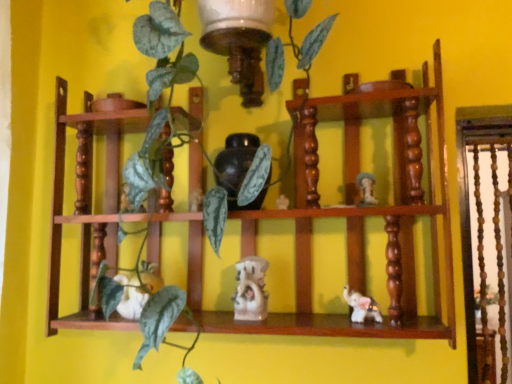
The width and height of the screenshot is (512, 384). I want to click on matte black vase at center, so click(x=237, y=168).

What do you see at coordinates (348, 227) in the screenshot?
I see `wooden shelf at center` at bounding box center [348, 227].

Locate an element on the screen. The width and height of the screenshot is (512, 384). white glossy elephant at lower right, positioned as the third toy in left-to-right order is located at coordinates (361, 306).

This screenshot has width=512, height=384. In order to click on white matte rabbit at center, the fourth toy from the right in this screenshot , I will do `click(138, 290)`.

This screenshot has width=512, height=384. I want to click on matte black vase at center, so click(x=237, y=168).

Is white glossy elephant at lower right, positioned as the second toy in right-to-left order, aimed at white glossy mushroom at upper right, positioned as the fourth toy in left-to-right order?

No, white glossy elephant at lower right, positioned as the second toy in right-to-left order, is not aimed at white glossy mushroom at upper right, positioned as the fourth toy in left-to-right order.

From a real-world perspective, is white glossy elephant at lower right, positioned as the second toy in right-to-left order, beneath white glossy mushroom at upper right, the first toy viewed from the right?

Correct, in the physical world, white glossy elephant at lower right, positioned as the second toy in right-to-left order, is lower than white glossy mushroom at upper right, the first toy viewed from the right.

There is a white glossy mushroom at upper right, the first toy viewed from the right. Where is `the 3rd toy below it (from the image's perspective)`? The width and height of the screenshot is (512, 384). the 3rd toy below it (from the image's perspective) is located at coordinates (361, 306).

Which of these two, wooden shelf at center or white glossy mushroom at upper right, the first toy viewed from the right, is thinner?

white glossy mushroom at upper right, the first toy viewed from the right, is thinner.

From a real-world perspective, is wooden shelf at center physically located above or below white glossy mushroom at upper right, the first toy viewed from the right?

In terms of real-world spatial position, wooden shelf at center is above white glossy mushroom at upper right, the first toy viewed from the right.

Between wooden shelf at center and white glossy mushroom at upper right, the first toy viewed from the right, which one appears on the right side from the viewer's perspective?

white glossy mushroom at upper right, the first toy viewed from the right, is more to the right.

Considering the relative sizes of white glossy mushroom at upper right, the first toy viewed from the right, and white matte rabbit at center, arranged as the first toy when viewed from the left, in the image provided, is white glossy mushroom at upper right, the first toy viewed from the right, wider than white matte rabbit at center, arranged as the first toy when viewed from the left,?

No.

From the picture: Would you say white glossy mushroom at upper right, the first toy viewed from the right, is outside white matte rabbit at center, the fourth toy from the right?

Indeed, white glossy mushroom at upper right, the first toy viewed from the right, is completely outside white matte rabbit at center, the fourth toy from the right.

Is white glossy mushroom at upper right, the first toy viewed from the right, far from white matte rabbit at center, the fourth toy from the right?

They are positioned close to each other.

Where is `the 3rd toy counting from the left side of the white glossy mushroom at upper right, positioned as the fourth toy in left-to-right order`? This screenshot has height=384, width=512. the 3rd toy counting from the left side of the white glossy mushroom at upper right, positioned as the fourth toy in left-to-right order is located at coordinates (138, 290).

Can you see white glossy mushroom at upper right, the first toy viewed from the right, touching matte black vase at center?

No, white glossy mushroom at upper right, the first toy viewed from the right, is not touching matte black vase at center.

Looking at this image, from a real-world perspective, relative to matte black vase at center, is white glossy mushroom at upper right, positioned as the fourth toy in left-to-right order, vertically above or below?

white glossy mushroom at upper right, positioned as the fourth toy in left-to-right order, is below matte black vase at center.

Considering the sizes of objects white glossy mushroom at upper right, the first toy viewed from the right, and matte black vase at center in the image provided, who is taller, white glossy mushroom at upper right, the first toy viewed from the right, or matte black vase at center?

matte black vase at center is taller.

Considering the relative sizes of white glossy mushroom at upper right, positioned as the fourth toy in left-to-right order, and matte black vase at center in the image provided, is white glossy mushroom at upper right, positioned as the fourth toy in left-to-right order, thinner than matte black vase at center?

Correct, the width of white glossy mushroom at upper right, positioned as the fourth toy in left-to-right order, is less than that of matte black vase at center.

Does point (234, 216) come in front of point (246, 307)?

No.

Can you confirm if wooden shelf at center is bigger than white glossy statue at center, arranged as the 3th toy when viewed from the right?

Yes.

Is wooden shelf at center taller or shorter than white glossy statue at center, arranged as the 3th toy when viewed from the right?

In the image, wooden shelf at center appears to be taller than white glossy statue at center, arranged as the 3th toy when viewed from the right.

Is wooden shelf at center directly adjacent to white glossy statue at center, arranged as the 3th toy when viewed from the right?

No, wooden shelf at center is not with white glossy statue at center, arranged as the 3th toy when viewed from the right.

From a real-world perspective, who is located higher, white glossy elephant at lower right, positioned as the second toy in right-to-left order, or white glossy statue at center, arranged as the 2th toy when viewed from the left?

white glossy statue at center, arranged as the 2th toy when viewed from the left.

Could you tell me if white glossy elephant at lower right, positioned as the second toy in right-to-left order, is turned towards white glossy statue at center, arranged as the 3th toy when viewed from the right?

No, white glossy elephant at lower right, positioned as the second toy in right-to-left order, is not aimed at white glossy statue at center, arranged as the 3th toy when viewed from the right.

Could white glossy statue at center, arranged as the 3th toy when viewed from the right, be considered to be inside white glossy elephant at lower right, positioned as the second toy in right-to-left order?

No.

Can you see white glossy elephant at lower right, positioned as the third toy in left-to-right order, touching white glossy statue at center, arranged as the 2th toy when viewed from the left?

No, white glossy elephant at lower right, positioned as the third toy in left-to-right order, is not with white glossy statue at center, arranged as the 2th toy when viewed from the left.

Is white glossy statue at center, arranged as the 3th toy when viewed from the right, not near white glossy mushroom at upper right, positioned as the fourth toy in left-to-right order?

That's not correct — white glossy statue at center, arranged as the 3th toy when viewed from the right, is a little close to white glossy mushroom at upper right, positioned as the fourth toy in left-to-right order.

Which of these two, white glossy statue at center, arranged as the 2th toy when viewed from the left, or white glossy mushroom at upper right, positioned as the fourth toy in left-to-right order, stands taller?

white glossy statue at center, arranged as the 2th toy when viewed from the left, is taller.

Is white glossy statue at center, arranged as the 3th toy when viewed from the right, at the right side of white glossy mushroom at upper right, positioned as the fourth toy in left-to-right order?

Incorrect, white glossy statue at center, arranged as the 3th toy when viewed from the right, is not on the right side of white glossy mushroom at upper right, positioned as the fourth toy in left-to-right order.

Does point (253, 272) appear closer or farther from the camera than point (362, 195)?

Clearly, point (253, 272) is closer to the camera than point (362, 195).

Identify the location of the 3rd toy positioned below the white glossy mushroom at upper right, the first toy viewed from the right (from a real-world perspective). (361, 306).

At what (x,y) coordinates should I click in order to perform the action: click on the 3rd toy counting from the right side of the wooden shelf at center. Please return your answer as a coordinate pair (x, y). This screenshot has width=512, height=384. Looking at the image, I should click on click(366, 189).

Considering their positions, is white glossy mushroom at upper right, the first toy viewed from the right, positioned closer to matte black vase at center than white glossy statue at center, arranged as the 3th toy when viewed from the right?

white glossy statue at center, arranged as the 3th toy when viewed from the right.

When comparing their distances from white matte rabbit at center, arranged as the first toy when viewed from the left, does wooden shelf at center or white glossy mushroom at upper right, the first toy viewed from the right, seem further?

Among the two, white glossy mushroom at upper right, the first toy viewed from the right, is located further to white matte rabbit at center, arranged as the first toy when viewed from the left.

From the image, which object appears to be nearer to matte black vase at center, white glossy elephant at lower right, positioned as the second toy in right-to-left order, or white matte rabbit at center, the fourth toy from the right?

Based on the image, white matte rabbit at center, the fourth toy from the right, appears to be nearer to matte black vase at center.

Considering their positions, is wooden shelf at center positioned further to matte black vase at center than white glossy statue at center, arranged as the 3th toy when viewed from the right?

Based on the image, wooden shelf at center appears to be further to matte black vase at center.

Considering their positions, is white glossy elephant at lower right, positioned as the third toy in left-to-right order, positioned further to white glossy statue at center, arranged as the 3th toy when viewed from the right, than wooden shelf at center?

wooden shelf at center.

Looking at this image, which object lies nearer to the anchor point matte black vase at center, wooden shelf at center or white matte rabbit at center, arranged as the first toy when viewed from the left?

The object closer to matte black vase at center is wooden shelf at center.

From the image, which object appears to be farther from matte black vase at center, white matte rabbit at center, arranged as the first toy when viewed from the left, or white glossy mushroom at upper right, positioned as the fourth toy in left-to-right order?

white matte rabbit at center, arranged as the first toy when viewed from the left, lies further to matte black vase at center than the other object.

When comparing their distances from matte black vase at center, does white glossy statue at center, arranged as the 3th toy when viewed from the right, or white glossy mushroom at upper right, the first toy viewed from the right, seem closer?

white glossy statue at center, arranged as the 3th toy when viewed from the right, is positioned closer to the anchor matte black vase at center.

Image resolution: width=512 pixels, height=384 pixels. I want to click on vase between wooden shelf at center and white glossy elephant at lower right, positioned as the second toy in right-to-left order, in the horizontal direction, so click(237, 168).

Where is `shelf located between white matte rabbit at center, arranged as the first toy when viewed from the left, and white glossy statue at center, arranged as the 2th toy when viewed from the left, in the left-right direction`? The image size is (512, 384). shelf located between white matte rabbit at center, arranged as the first toy when viewed from the left, and white glossy statue at center, arranged as the 2th toy when viewed from the left, in the left-right direction is located at coordinates (348, 227).

You are a GUI agent. You are given a task and a screenshot of the screen. Output one action in this format:
    pyautogui.click(x=<x>, y=<y>)
    Task: Click on the shelf that lies between matte black vase at center and white glossy statue at center, arranged as the 2th toy when viewed from the left, from top to bottom
    
    Given the screenshot: What is the action you would take?
    pyautogui.click(x=348, y=227)

This screenshot has width=512, height=384. In order to click on vase between white matte rabbit at center, arranged as the first toy when viewed from the left, and white glossy mushroom at upper right, positioned as the fourth toy in left-to-right order, in the horizontal direction in this screenshot , I will do `click(237, 168)`.